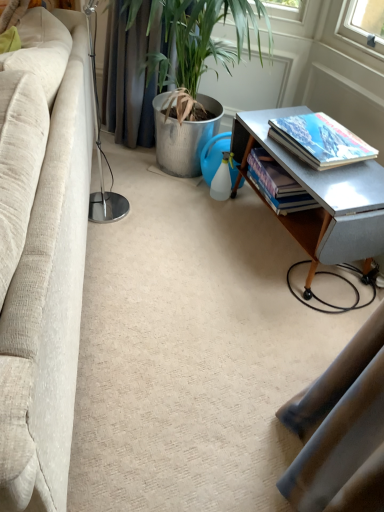
Question: In terms of size, does beige fabric couch at left appear bigger or smaller than hardcover book at right, the 2th book viewed from the front?

Choices:
 (A) big
 (B) small

Answer: (A)

Question: Is beige fabric couch at left in front of or behind hardcover book at right, the 2th book viewed from the front, in the image?

Choices:
 (A) front
 (B) behind

Answer: (A)

Question: Estimate the real-world distances between objects in this image. Which object is farther from the hardcover book at right, the first book positioned from the front?

Choices:
 (A) beige fabric couch at left
 (B) hardcover book at right, which appears as the 1th book when viewed from the back
 (C) metallic gray table at right

Answer: (A)

Question: Estimate the real-world distances between objects in this image. Which object is farther from the beige fabric couch at left?

Choices:
 (A) metallic gray table at right
 (B) hardcover book at right, the first book positioned from the front
 (C) hardcover book at right, which appears as the 1th book when viewed from the back

Answer: (B)